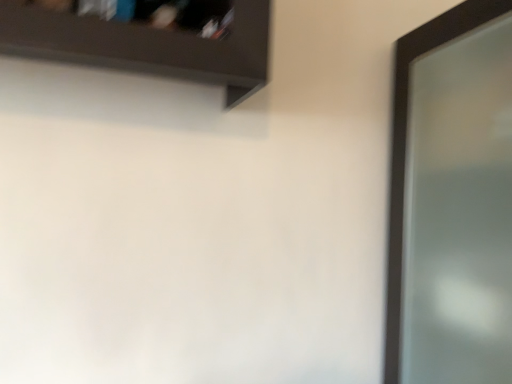
Question: In terms of width, does dark brown wooden shelf at upper left look wider or thinner when compared to clear glass screen door at right?

Choices:
 (A) wide
 (B) thin

Answer: (B)

Question: Is dark brown wooden shelf at upper left bigger or smaller than clear glass screen door at right?

Choices:
 (A) big
 (B) small

Answer: (B)

Question: Considering the positions of dark brown wooden shelf at upper left and clear glass screen door at right in the image, is dark brown wooden shelf at upper left taller or shorter than clear glass screen door at right?

Choices:
 (A) tall
 (B) short

Answer: (B)

Question: Choose the correct answer: Is clear glass screen door at right inside dark brown wooden shelf at upper left or outside it?

Choices:
 (A) outside
 (B) inside

Answer: (A)

Question: Considering the positions of clear glass screen door at right and dark brown wooden shelf at upper left in the image, is clear glass screen door at right bigger or smaller than dark brown wooden shelf at upper left?

Choices:
 (A) big
 (B) small

Answer: (A)

Question: Relative to dark brown wooden shelf at upper left, is clear glass screen door at right in front or behind?

Choices:
 (A) front
 (B) behind

Answer: (B)

Question: Is point (444, 125) closer or farther from the camera than point (194, 39)?

Choices:
 (A) closer
 (B) farther

Answer: (B)